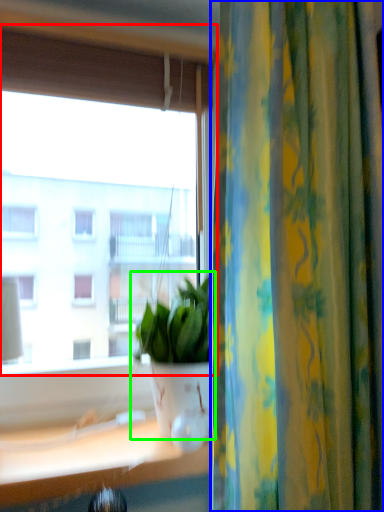
Question: Considering the real-world distances, which object is farthest from window (highlighted by a red box)? curtain (highlighted by a blue box) or houseplant (highlighted by a green box)?

Choices:
 (A) curtain
 (B) houseplant

Answer: (A)